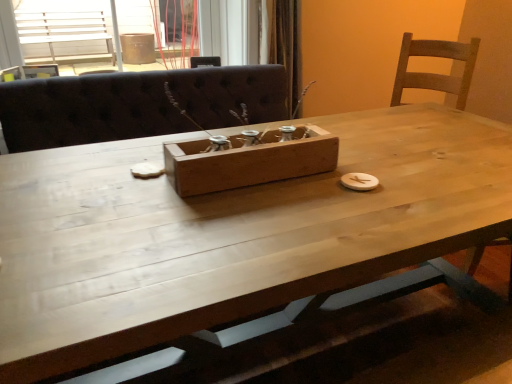
What is the approximate width of wooden frame at upper center?

4.77 feet.

Image resolution: width=512 pixels, height=384 pixels. I want to click on wooden box at center, so click(x=249, y=161).

Would you consider wooden frame at upper center to be distant from wooden box at center?

Absolutely, wooden frame at upper center is distant from wooden box at center.

From the image's perspective, does wooden frame at upper center appear lower than wooden box at center?

No, from the image's perspective, wooden frame at upper center is not below wooden box at center.

Does wooden frame at upper center turn towards wooden box at center?

No, wooden frame at upper center does not turn towards wooden box at center.

Could you tell me if wooden box at center is turned towards wooden frame at upper center?

No, wooden box at center is not aimed at wooden frame at upper center.

From the image's perspective, does wooden box at center appear lower than wooden frame at upper center?

Yes, from the image's perspective, wooden box at center is below wooden frame at upper center.

Is wooden box at center positioned in front of wooden frame at upper center?

Yes.

From a real-world perspective, does wooden frame at upper center stand above natural wood table at center?

Correct, in the physical world, wooden frame at upper center is higher than natural wood table at center.

Measure the distance from wooden frame at upper center to natural wood table at center.

wooden frame at upper center is 1.49 meters from natural wood table at center.

Is natural wood table at center at the back of wooden frame at upper center?

No.

The height and width of the screenshot is (384, 512). Identify the location of table in front of the wooden frame at upper center. (228, 224).

Is natural wood table at center far from wooden box at center?

natural wood table at center is actually quite close to wooden box at center.

Which is behind, point (35, 290) or point (262, 167)?

Positioned behind is point (262, 167).

From a real-world perspective, is natural wood table at center positioned above or below wooden box at center?

From a real-world perspective, natural wood table at center is physically below wooden box at center.

Is natural wood table at center positioned with its back to wooden box at center?

No, natural wood table at center's orientation is not away from wooden box at center.

Considering the relative sizes of natural wood table at center and wooden frame at upper center in the image provided, is natural wood table at center bigger than wooden frame at upper center?

Correct, natural wood table at center is larger in size than wooden frame at upper center.

Where is `window located above the natural wood table at center (from a real-world perspective)`? window located above the natural wood table at center (from a real-world perspective) is located at coordinates (229, 30).

Is wooden frame at upper center surrounded by natural wood table at center?

No, wooden frame at upper center is not a part of natural wood table at center.

Does natural wood table at center appear on the left side of wooden frame at upper center?

In fact, natural wood table at center is to the right of wooden frame at upper center.

From a real-world perspective, which object stands above the other?

wooden box at center, from a real-world perspective.

Considering the relative sizes of wooden box at center and natural wood table at center in the image provided, is wooden box at center thinner than natural wood table at center?

Yes.

I want to click on table below the wooden box at center (from the image's perspective), so click(x=228, y=224).

Is wooden box at center aimed at natural wood table at center?

No, wooden box at center is not oriented towards natural wood table at center.

This screenshot has height=384, width=512. Identify the location of window on the left of the wooden box at center. (229, 30).

Find the location of a particular element. This screenshot has width=512, height=384. cardboard box lying on the right of wooden frame at upper center is located at coordinates (249, 161).

In the scene shown: From the image, which object appears to be nearer to natural wood table at center, wooden box at center or wooden frame at upper center?

wooden box at center.

Which object lies nearer to the anchor point wooden frame at upper center, natural wood table at center or wooden box at center?

wooden box at center is closer to wooden frame at upper center.

Looking at the image, which one is located closer to wooden box at center, wooden frame at upper center or natural wood table at center?

natural wood table at center is closer to wooden box at center.

From the picture: From the image, which object appears to be nearer to wooden frame at upper center, wooden box at center or natural wood table at center?

wooden box at center is positioned closer to the anchor wooden frame at upper center.

From the image, which object appears to be nearer to wooden box at center, natural wood table at center or wooden frame at upper center?

The object closer to wooden box at center is natural wood table at center.

Which object lies nearer to the anchor point natural wood table at center, wooden frame at upper center or wooden box at center?

wooden box at center.

Where is `cardboard box located between natural wood table at center and wooden frame at upper center in the depth direction`? The height and width of the screenshot is (384, 512). cardboard box located between natural wood table at center and wooden frame at upper center in the depth direction is located at coordinates (249, 161).